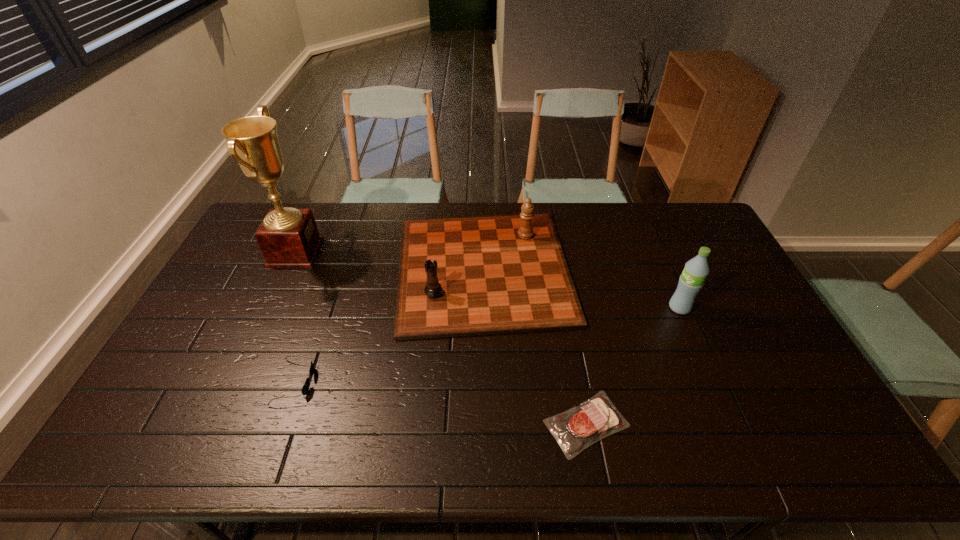
Locate an element on the screen. The height and width of the screenshot is (540, 960). vacant space at the left edge is located at coordinates (172, 379).

In the image, there is a desktop. At what (x,y) coordinates should I click in order to perform the action: click on vacant space at the right edge. Please return your answer as a coordinate pair (x, y). Looking at the image, I should click on (736, 278).

You are a GUI agent. You are given a task and a screenshot of the screen. Output one action in this format:
    pyautogui.click(x=<x>, y=<y>)
    Task: Click on the free space at the far right corner
    
    Given the screenshot: What is the action you would take?
    pyautogui.click(x=677, y=226)

Identify the location of free space between the steak and the fourth shortest object. (633, 366).

Identify the location of vacant area between the second tallest object and the fourth tallest object. (487, 345).

The image size is (960, 540). Find the location of `empty space that is in between the water bottle and the second object from left to right`. empty space that is in between the water bottle and the second object from left to right is located at coordinates (487, 345).

At what (x,y) coordinates should I click in order to perform the action: click on free space between the tallest object and the third tallest object. Please return your answer as a coordinate pair (x, y). Looking at the image, I should click on (390, 261).

Identify the location of free area in between the third shortest object and the trophy cup. (390, 261).

You are a GUI agent. You are given a task and a screenshot of the screen. Output one action in this format:
    pyautogui.click(x=<x>, y=<y>)
    Task: Click on the vacant region between the rightmost object and the gameboard
    Image resolution: width=960 pixels, height=540 pixels.
    Given the screenshot: What is the action you would take?
    pyautogui.click(x=582, y=288)

The height and width of the screenshot is (540, 960). I want to click on free space between the trophy cup and the third tallest object, so click(390, 261).